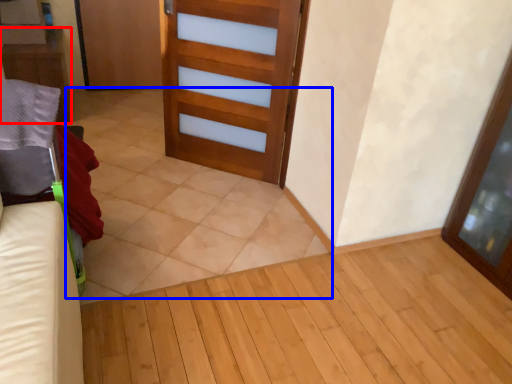
Question: Which object appears closest to the camera in this image, furniture (highlighted by a red box) or tile (highlighted by a blue box)?

Choices:
 (A) furniture
 (B) tile

Answer: (B)